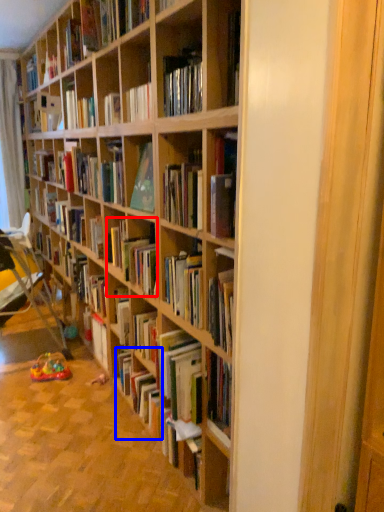
Question: Which object is closer to the camera taking this photo, book (highlighted by a red box) or book (highlighted by a blue box)?

Choices:
 (A) book
 (B) book

Answer: (B)